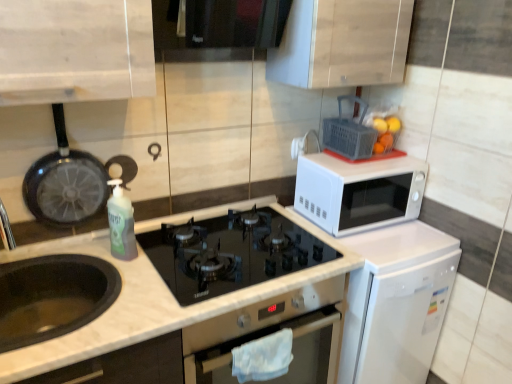
At what (x,y) coordinates should I click in order to perform the action: click on free point behind translucent plastic bottle at center-left. Please return your answer as a coordinate pair (x, y). The height and width of the screenshot is (384, 512). Looking at the image, I should click on (147, 241).